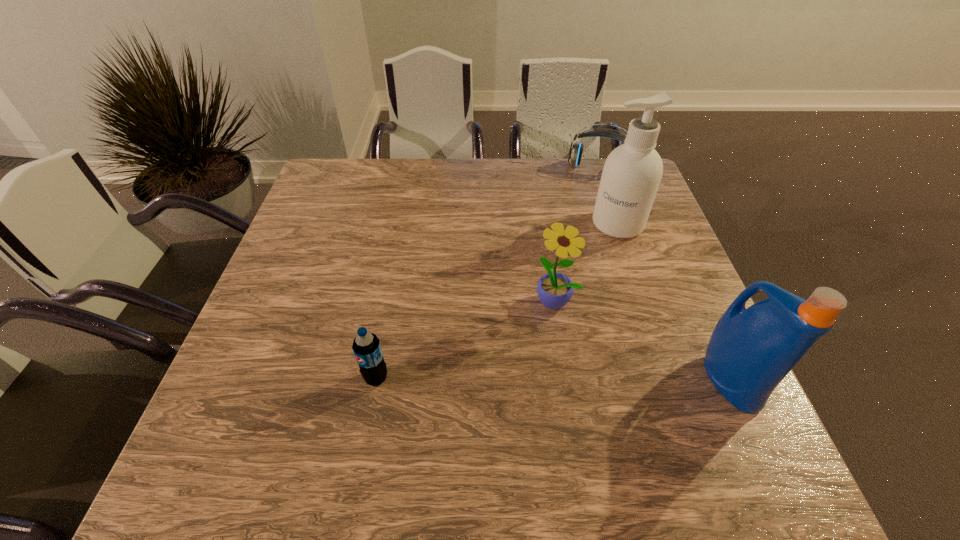
I want to click on free space on the desktop that is between the soda bottle and the fourth shortest object and is positioned on the front label of the fourth nearest object, so click(x=526, y=379).

Where is `vacant space on the desktop that is between the leftmost object and the detergent and is positioned on the ear cups of the headset`? This screenshot has height=540, width=960. vacant space on the desktop that is between the leftmost object and the detergent and is positioned on the ear cups of the headset is located at coordinates (563, 379).

At what (x,y) coordinates should I click in order to perform the action: click on vacant space on the desktop that is between the leftmost object and the detergent and is positioned on the front-facing side of the third farthest object. Please return your answer as a coordinate pair (x, y). This screenshot has height=540, width=960. Looking at the image, I should click on (515, 379).